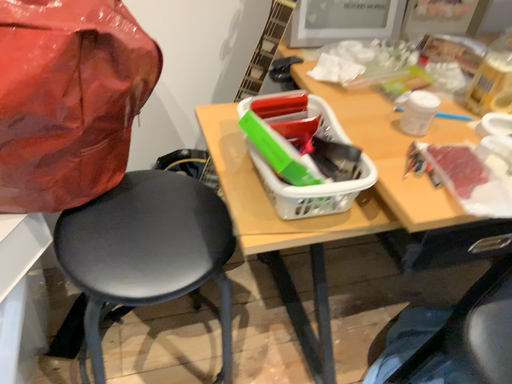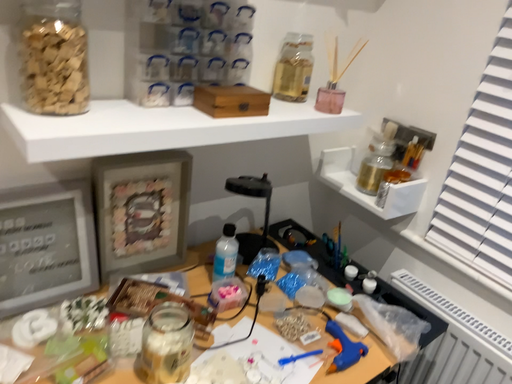
Question: How did the camera likely rotate when shooting the video?

Choices:
 (A) rotated downward
 (B) rotated upward

Answer: (B)